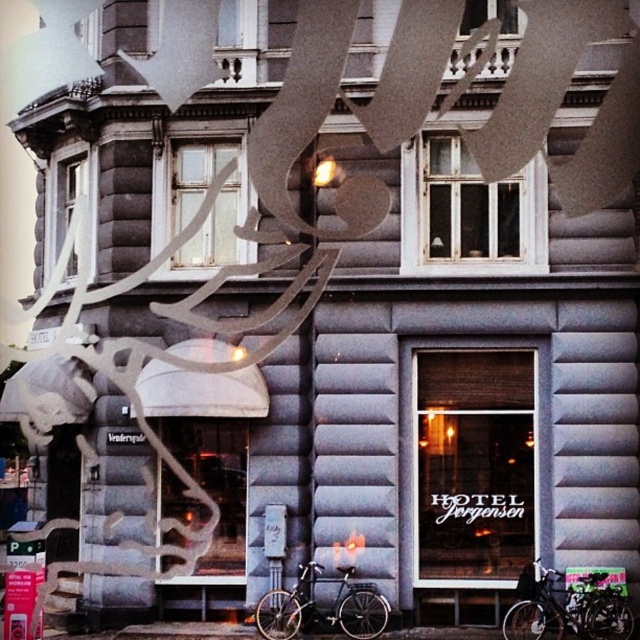
You are a delivery person trying to park your black matte bicycle at lower right near the white wooden window at center. Considering the space between them, can the bicycle fit without blocking the window?

The black matte bicycle at lower right might be wider than white wooden window at center, so there is a possibility that parking the bicycle could block the window. Check the exact dimensions before deciding.

You are standing in front of the building and notice two windows at the center. The clear glass window at center and the white wooden window at center. Which one is positioned to the right?

The clear glass window at center is to the right of the white wooden window at center, so the clear glass window at center is positioned to the right.

You are a delivery person who needs to park your bicycle in a space that can only accommodate bicycles narrower than 1.2 meters. You see the black matte bicycle at lower right and the shiny black bicycle at lower center. Which bicycle can fit into the space?

The black matte bicycle at lower right has a lesser width compared to the shiny black bicycle at lower center, so it can fit into the space that accommodates bicycles narrower than 1.2 meters.